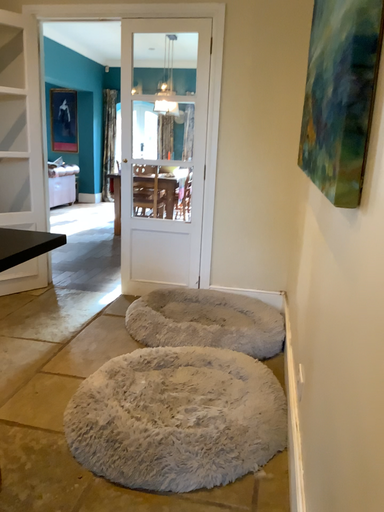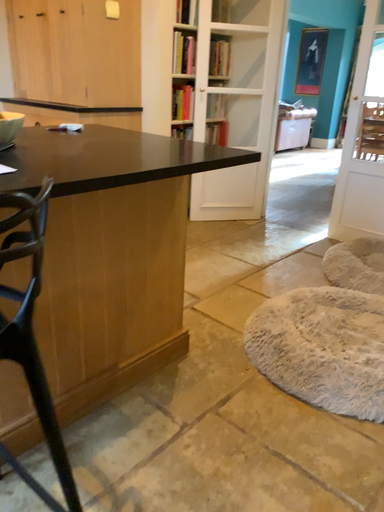
Question: Which way did the camera rotate in the video?

Choices:
 (A) rotated left
 (B) rotated right

Answer: (A)